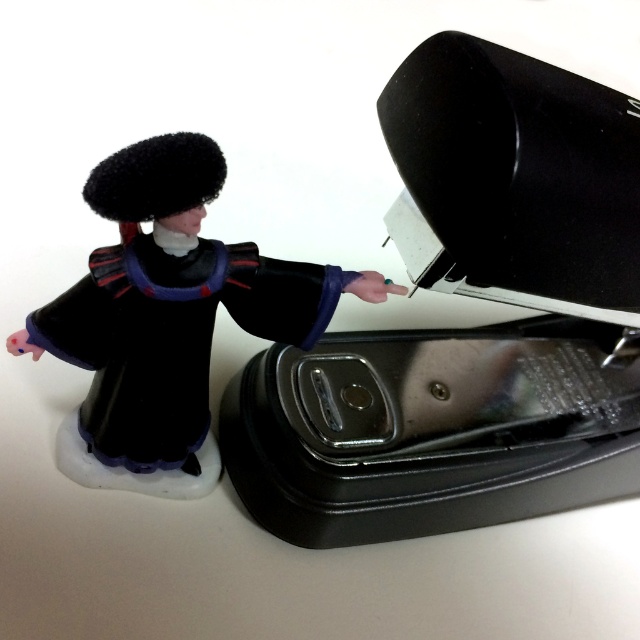
You are organizing a desk and need to place the black matte stapler at upper right and the velvet black robe at left. According to the image, which object is located to the right of the other?

The black matte stapler at upper right is positioned on the right side of the velvet black robe at left.

You are organizing a desk and need to place a new item at the point marked by coordinates point [467,328]. What object is currently located at that position?

The point [467,328] indicates the location of the black matte stapler at upper right.

You are organizing a desk and need to place the black matte stapler at upper right and the figurine in traditional attire next to each other. The desk has a space that is 30 inches wide. Can both items fit side by side without overlapping?

The distance between the black matte stapler at upper right and the figurine in traditional attire is 30.56 inches. Since the desk space is only 30 inches wide, they cannot fit side by side without overlapping.